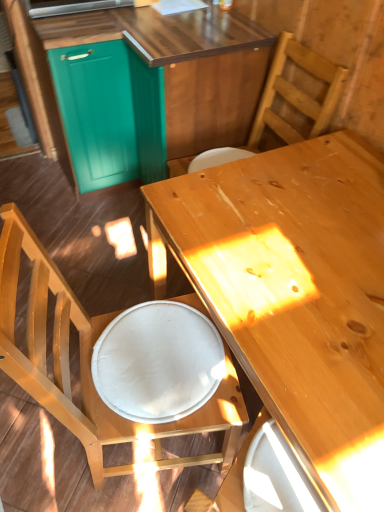
In order to face wooden chair at upper right, which is the second chair in bottom-to-top order, should I rotate leftwards or rightwards?

You should rotate right by 7.396 degrees.

Identify the location of light brown wood desk at center. (304, 303).

This screenshot has width=384, height=512. Identify the location of white fabric plate at lower center. (158, 362).

Is point (346, 422) behind point (134, 151)?

No.

Considering the relative positions of light brown wood desk at center and teal wood cabinetry at upper left in the image provided, is light brown wood desk at center behind teal wood cabinetry at upper left?

No, light brown wood desk at center is in front of teal wood cabinetry at upper left.

Is light brown wood desk at center beside teal wood cabinetry at upper left?

light brown wood desk at center and teal wood cabinetry at upper left are clearly separated.

Is light brown wood desk at center spatially inside teal wood cabinetry at upper left, or outside of it?

light brown wood desk at center is spatially situated outside teal wood cabinetry at upper left.

Is white fabric plate at lower center turned away from wooden chair at upper right, which is the 1th chair in top-to-bottom order?

No.

Do you think white fabric plate at lower center is within wooden chair at upper right, which is the second chair in bottom-to-top order, or outside of it?

white fabric plate at lower center is not inside wooden chair at upper right, which is the second chair in bottom-to-top order, it's outside.

Between point (138, 328) and point (265, 119), which one is positioned behind?

The point (265, 119) is farther from the camera.

From a real-world perspective, is white fabric plate at lower center positioned above or below wooden chair at upper right, which is the second chair in bottom-to-top order?

Clearly, from a real-world perspective, white fabric plate at lower center is below wooden chair at upper right, which is the second chair in bottom-to-top order.

Would you say wooden chair at lower left, which appears as the first chair when ordered from the bottom, contains white fabric plate at lower center?

Yes, white fabric plate at lower center is surrounded by wooden chair at lower left, which appears as the first chair when ordered from the bottom.

Is wooden chair at lower left, which appears as the 2th chair when viewed from the top, beside white fabric plate at lower center?

No.

At what (x,y) coordinates should I click in order to perform the action: click on plate above the wooden chair at lower left, which appears as the 2th chair when viewed from the top (from a real-world perspective). Please return your answer as a coordinate pair (x, y). The height and width of the screenshot is (512, 384). Looking at the image, I should click on tap(158, 362).

Can you tell me how much wooden chair at lower left, which appears as the 2th chair when viewed from the top, and white fabric plate at lower center differ in facing direction?

The facing directions of wooden chair at lower left, which appears as the 2th chair when viewed from the top, and white fabric plate at lower center are 7.61e-05 degrees apart.

Is white fabric plate at lower center bigger than light brown wood desk at center?

No, white fabric plate at lower center is not bigger than light brown wood desk at center.

Is light brown wood desk at center completely or partially inside white fabric plate at lower center?

Definitely not — light brown wood desk at center is not inside white fabric plate at lower center.

Would you say white fabric plate at lower center is a long distance from light brown wood desk at center?

No.

Which object is more forward, white fabric plate at lower center or light brown wood desk at center?

Positioned in front is light brown wood desk at center.

Is the surface of wooden chair at lower left, which appears as the 2th chair when viewed from the top, in direct contact with light brown wood desk at center?

No, wooden chair at lower left, which appears as the 2th chair when viewed from the top, is not with light brown wood desk at center.

In terms of width, does wooden chair at lower left, which appears as the first chair when ordered from the bottom, look wider or thinner when compared to light brown wood desk at center?

wooden chair at lower left, which appears as the first chair when ordered from the bottom, is thinner than light brown wood desk at center.

Which object is more forward, wooden chair at lower left, which appears as the first chair when ordered from the bottom, or light brown wood desk at center?

wooden chair at lower left, which appears as the first chair when ordered from the bottom, is closer to the camera.

In the scene shown: From a real-world perspective, is wooden chair at lower left, which appears as the first chair when ordered from the bottom, located beneath light brown wood desk at center?

Incorrect, from a real-world perspective, wooden chair at lower left, which appears as the first chair when ordered from the bottom, is higher than light brown wood desk at center.

Would you say white fabric plate at lower center is outside wooden chair at lower left, which appears as the first chair when ordered from the bottom?

No, most part of white fabric plate at lower center lies within wooden chair at lower left, which appears as the first chair when ordered from the bottom.

Measure the distance between white fabric plate at lower center and wooden chair at lower left, which appears as the 2th chair when viewed from the top.

4.84 inches.

In the scene shown: From the image's perspective, relative to wooden chair at lower left, which appears as the first chair when ordered from the bottom, is white fabric plate at lower center above or below?

Based on their image positions, white fabric plate at lower center is located above wooden chair at lower left, which appears as the first chair when ordered from the bottom.

Can you tell me how much white fabric plate at lower center and wooden chair at lower left, which appears as the 2th chair when viewed from the top, differ in facing direction?

The facing directions of white fabric plate at lower center and wooden chair at lower left, which appears as the 2th chair when viewed from the top, are 7.61e-05 degrees apart.

Could white fabric plate at lower center be considered to be inside light brown wood desk at center?

That's incorrect, white fabric plate at lower center is not inside light brown wood desk at center.

From the image's perspective, which is below, light brown wood desk at center or white fabric plate at lower center?

white fabric plate at lower center appears lower in the image.

Does light brown wood desk at center have a lesser height compared to white fabric plate at lower center?

Incorrect, the height of light brown wood desk at center does not fall short of that of white fabric plate at lower center.

Find the location of a particular element. The image size is (384, 512). desk in front of the teal wood cabinetry at upper left is located at coordinates (304, 303).

Image resolution: width=384 pixels, height=512 pixels. What are the coordinates of `chair behind the white fabric plate at lower center` in the screenshot? It's located at (297, 92).

From the image, which object appears to be farther from light brown wood desk at center, wooden chair at upper right, which is the second chair in bottom-to-top order, or white fabric plate at lower center?

wooden chair at upper right, which is the second chair in bottom-to-top order, is positioned further to the anchor light brown wood desk at center.

Estimate the real-world distances between objects in this image. Which object is further from wooden chair at upper right, which is the second chair in bottom-to-top order, teal wood cabinetry at upper left or wooden chair at lower left, which appears as the 2th chair when viewed from the top?

Among the two, wooden chair at lower left, which appears as the 2th chair when viewed from the top, is located further to wooden chair at upper right, which is the second chair in bottom-to-top order.

Estimate the real-world distances between objects in this image. Which object is closer to wooden chair at upper right, which is the second chair in bottom-to-top order, white fabric plate at lower center or teal wood cabinetry at upper left?

teal wood cabinetry at upper left lies closer to wooden chair at upper right, which is the second chair in bottom-to-top order, than the other object.

Which object lies nearer to the anchor point wooden chair at upper right, which is the 1th chair in top-to-bottom order, white fabric plate at lower center or wooden chair at lower left, which appears as the 2th chair when viewed from the top?

white fabric plate at lower center lies closer to wooden chair at upper right, which is the 1th chair in top-to-bottom order, than the other object.

Based on their spatial positions, is light brown wood desk at center or wooden chair at upper right, which is the second chair in bottom-to-top order, closer to white fabric plate at lower center?

light brown wood desk at center is positioned closer to the anchor white fabric plate at lower center.

Based on their spatial positions, is wooden chair at lower left, which appears as the 2th chair when viewed from the top, or white fabric plate at lower center closer to wooden chair at upper right, which is the 1th chair in top-to-bottom order?

white fabric plate at lower center is closer to wooden chair at upper right, which is the 1th chair in top-to-bottom order.

When comparing their distances from white fabric plate at lower center, does teal wood cabinetry at upper left or wooden chair at lower left, which appears as the first chair when ordered from the bottom, seem further?

teal wood cabinetry at upper left.

Considering their positions, is wooden chair at upper right, which is the 1th chair in top-to-bottom order, positioned further to light brown wood desk at center than teal wood cabinetry at upper left?

The object further to light brown wood desk at center is teal wood cabinetry at upper left.

You are a GUI agent. You are given a task and a screenshot of the screen. Output one action in this format:
    pyautogui.click(x=<x>, y=<y>)
    Task: Click on the desk between wooden chair at upper right, which is the 1th chair in top-to-bottom order, and white fabric plate at lower center from top to bottom
    Image resolution: width=384 pixels, height=512 pixels.
    Given the screenshot: What is the action you would take?
    pyautogui.click(x=304, y=303)

Find the location of a particular element. plate between wooden chair at lower left, which appears as the 2th chair when viewed from the top, and light brown wood desk at center is located at coordinates (158, 362).

Locate an element on the screen. chair between teal wood cabinetry at upper left and white fabric plate at lower center vertically is located at coordinates (297, 92).

You are a GUI agent. You are given a task and a screenshot of the screen. Output one action in this format:
    pyautogui.click(x=<x>, y=<y>)
    Task: Click on the chair that lies between teal wood cabinetry at upper left and wooden chair at lower left, which appears as the 2th chair when viewed from the top, from top to bottom
    The image size is (384, 512).
    Given the screenshot: What is the action you would take?
    pyautogui.click(x=297, y=92)